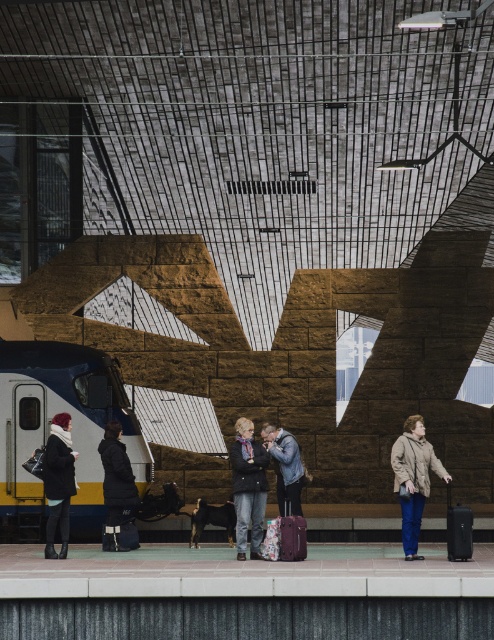
Question: Which object is positioned closest to the matte black coat at left?

Choices:
 (A) dark gray coat at center
 (B) blue metallic train at left
 (C) dark gray wool coat at center
 (D) denim jacket at center

Answer: (A)

Question: Considering the relative positions of dark gray coat at center and matte black coat at left in the image provided, where is dark gray coat at center located with respect to matte black coat at left?

Choices:
 (A) below
 (B) above

Answer: (A)

Question: Can you confirm if dark gray coat at center is bigger than matte black coat at left?

Choices:
 (A) yes
 (B) no

Answer: (A)

Question: Estimate the real-world distances between objects in this image. Which object is farther from the blue metallic train at left?

Choices:
 (A) denim jacket at center
 (B) beige wool coat at right

Answer: (B)

Question: From the image, what is the correct spatial relationship of matte black coat at left in relation to black matte suitcase at lower right?

Choices:
 (A) above
 (B) below

Answer: (A)

Question: Which object is positioned closest to the beige wool coat at right?

Choices:
 (A) matte black coat at left
 (B) dark gray wool coat at center
 (C) denim jacket at center
 (D) blue metallic train at left

Answer: (B)